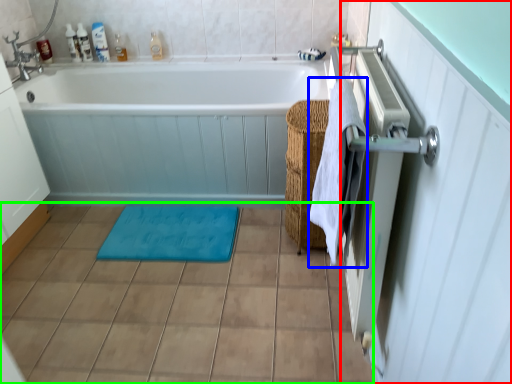
Question: Which is nearer to the screen door (highlighted by a red box)? beach towel (highlighted by a blue box) or ceramic tile (highlighted by a green box).

Choices:
 (A) beach towel
 (B) ceramic tile

Answer: (A)